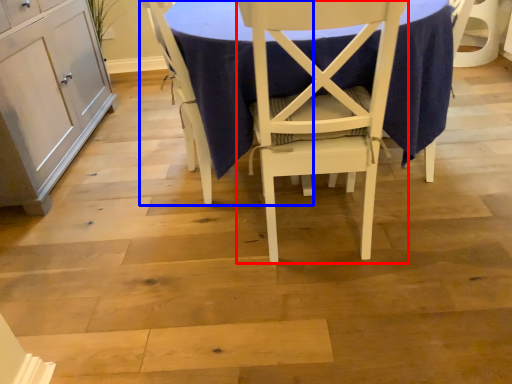
Question: Among these objects, which one is nearest to the camera, chair (highlighted by a red box) or chair (highlighted by a blue box)?

Choices:
 (A) chair
 (B) chair

Answer: (A)